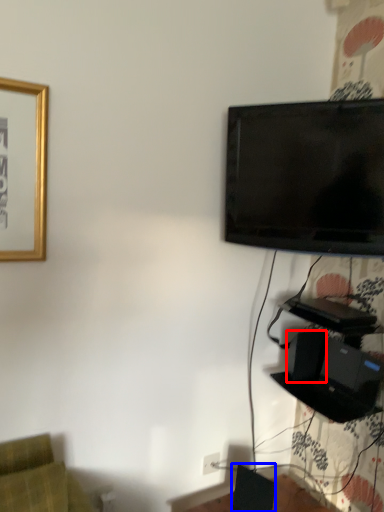
Question: Which object is closer to the camera taking this photo, speaker (highlighted by a red box) or speaker (highlighted by a blue box)?

Choices:
 (A) speaker
 (B) speaker

Answer: (B)